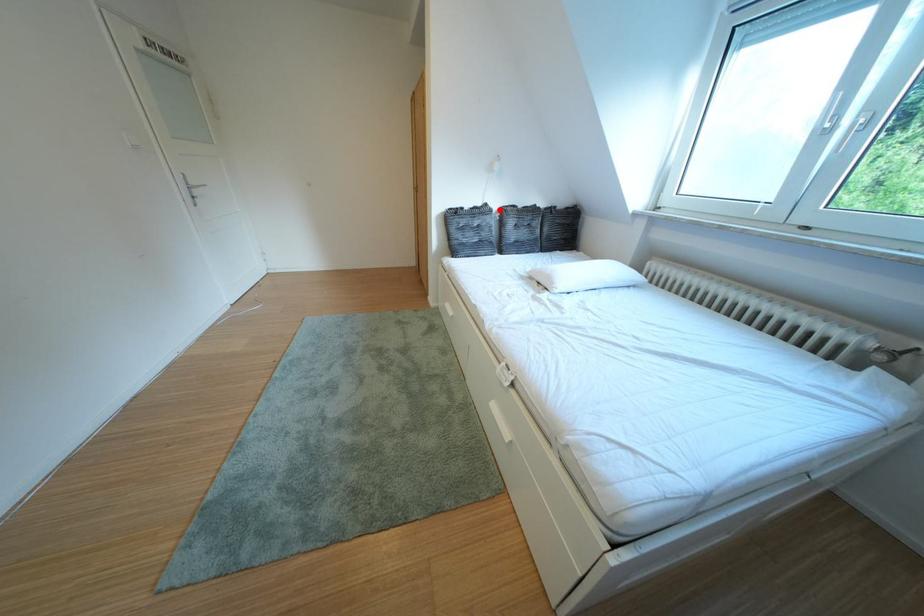
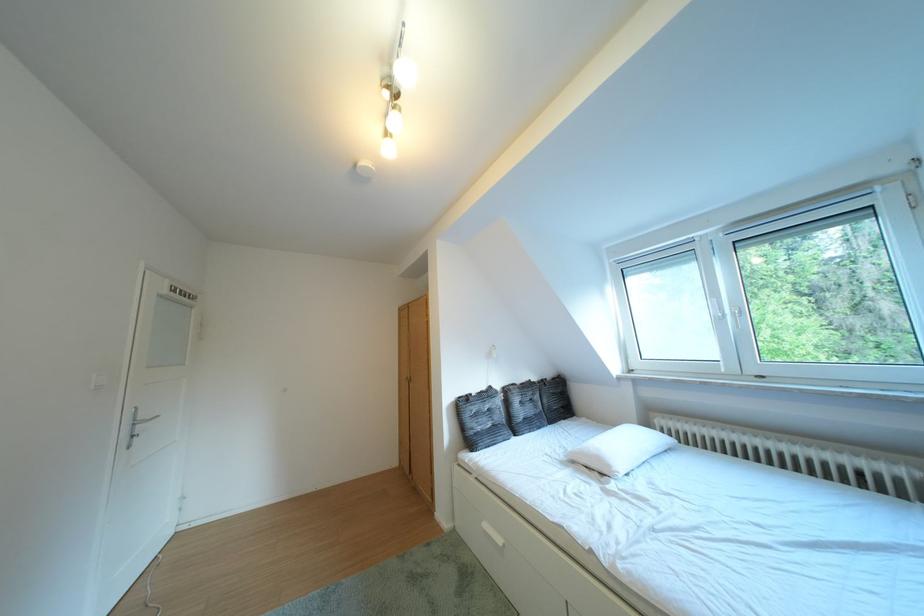
Question: I am providing you with two images of the same scene from different viewpoints. A red point is marked on the first image. Can you still see the location of the red point in image 2?

Choices:
 (A) Yes
 (B) No

Answer: (A)